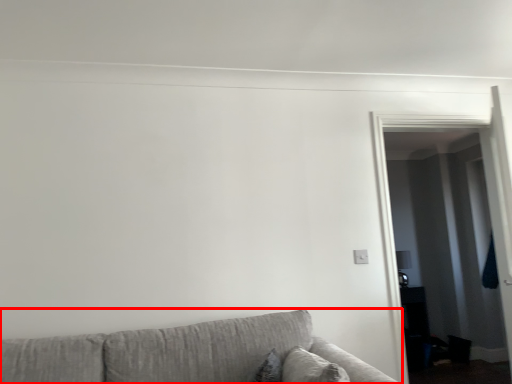
Question: From the image, what is the correct spatial relationship of studio couch (annotated by the red box) in relation to glass door?

Choices:
 (A) right
 (B) left

Answer: (B)